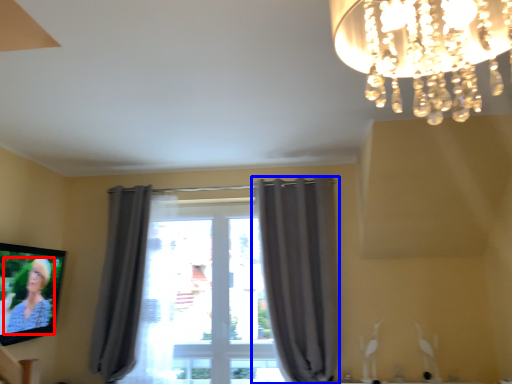
Question: Which object appears closest to the camera in this image, person (highlighted by a red box) or curtain (highlighted by a blue box)?

Choices:
 (A) person
 (B) curtain

Answer: (A)